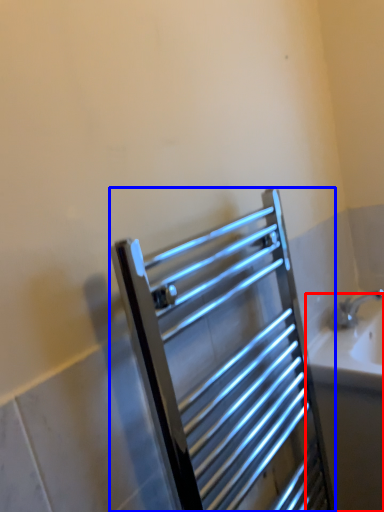
Question: Among these objects, which one is nearest to the camera, bath (highlighted by a red box) or screen door (highlighted by a blue box)?

Choices:
 (A) bath
 (B) screen door

Answer: (B)